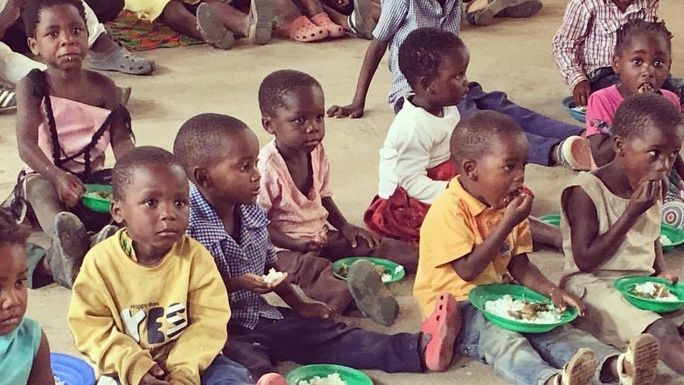
This screenshot has height=385, width=684. Find the location of `blanket`. blanket is located at coordinates (395, 225).